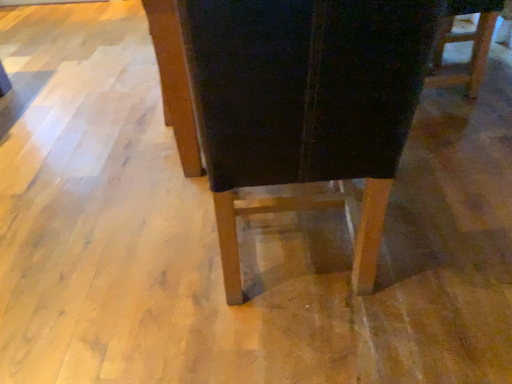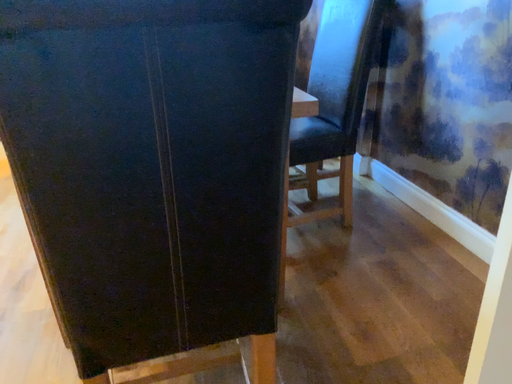
Question: How did the camera likely rotate when shooting the video?

Choices:
 (A) rotated right
 (B) rotated left

Answer: (A)